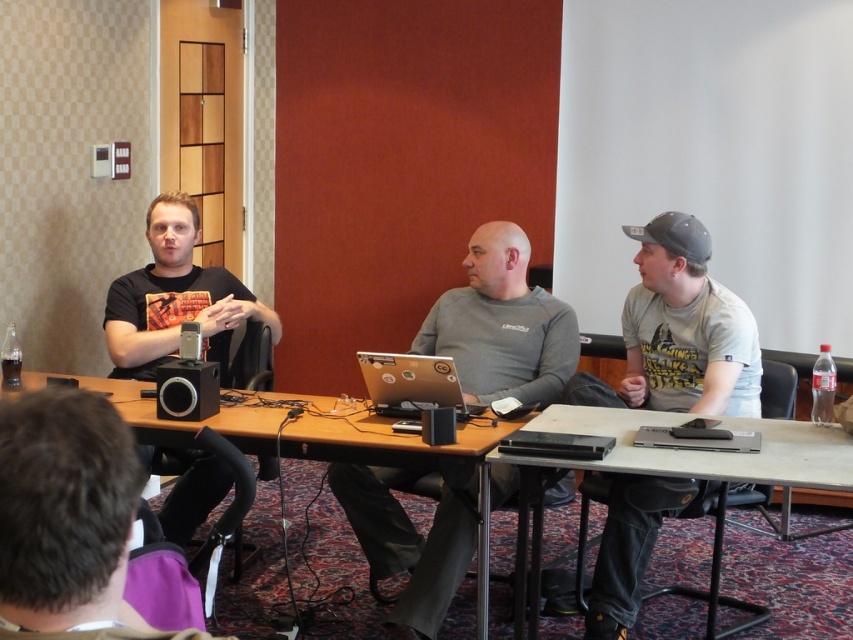
Is black plastic table at center to the right of silver metallic laptop at center from the viewer's perspective?

Correct, you'll find black plastic table at center to the right of silver metallic laptop at center.

Is black plastic table at center above silver metallic laptop at center?

No.

Who is more distant from viewer, (849, 444) or (427, 358)?

The point (427, 358) is behind.

At what (x,y) coordinates should I click in order to perform the action: click on black plastic table at center. Please return your answer as a coordinate pair (x, y). Looking at the image, I should click on (704, 451).

Can you confirm if gray matte laptop at center is wider than wooden table at center?

Incorrect, gray matte laptop at center's width does not surpass wooden table at center's.

Is point (354, 472) positioned in front of point (376, 429)?

No, it is not.

Is point (405, 616) positioned in front of point (213, 426)?

Yes, it is.

Locate an element on the screen. gray matte laptop at center is located at coordinates pyautogui.click(x=502, y=324).

Which is behind, point (618, 586) or point (457, 403)?

The point (457, 403) is more distant.

You are a GUI agent. You are given a task and a screenshot of the screen. Output one action in this format:
    pyautogui.click(x=<x>, y=<y>)
    Task: Click on the gray cotton t-shirt at right
    This screenshot has height=640, width=853.
    Given the screenshot: What is the action you would take?
    pyautogui.click(x=679, y=332)